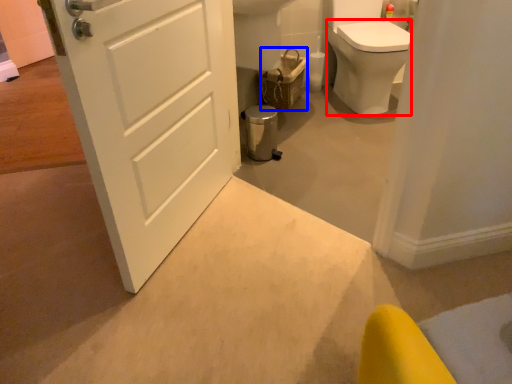
Question: Which object is further to the camera taking this photo, bidet (highlighted by a red box) or basket (highlighted by a blue box)?

Choices:
 (A) bidet
 (B) basket

Answer: (B)